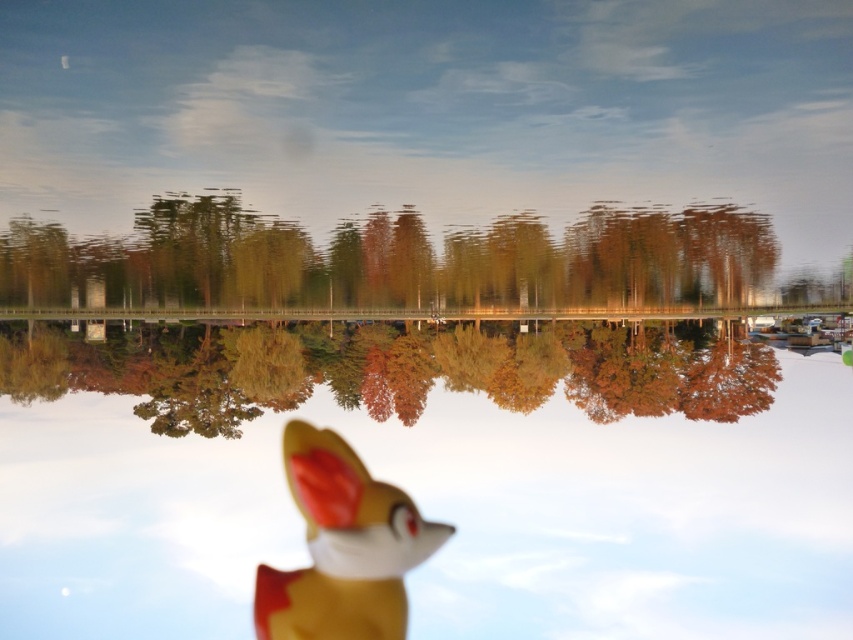
Between transparent glass water at center and soft yellow plush toy at center, which one is positioned higher?

transparent glass water at center is above.

Does point (709, 362) come in front of point (378, 566)?

Yes, it is.

Is point (798, 356) positioned behind point (300, 502)?

Yes, it is behind point (300, 502).

The height and width of the screenshot is (640, 853). Find the location of `transparent glass water at center`. transparent glass water at center is located at coordinates (430, 474).

Who is shorter, transparent glass water at center or autumn leaves at upper center?

With less height is autumn leaves at upper center.

Is the position of transparent glass water at center less distant than that of autumn leaves at upper center?

No, transparent glass water at center is behind autumn leaves at upper center.

Who is more distant from viewer, (96, 492) or (247, 298)?

The point (96, 492) is behind.

Locate an element on the screen. This screenshot has width=853, height=640. transparent glass water at center is located at coordinates (430, 474).

Which is in front, point (619, 262) or point (340, 563)?

Point (619, 262) is more forward.

Is autumn leaves at upper center shorter than soft yellow plush toy at center?

Yes, autumn leaves at upper center is shorter than soft yellow plush toy at center.

I want to click on autumn leaves at upper center, so click(x=393, y=259).